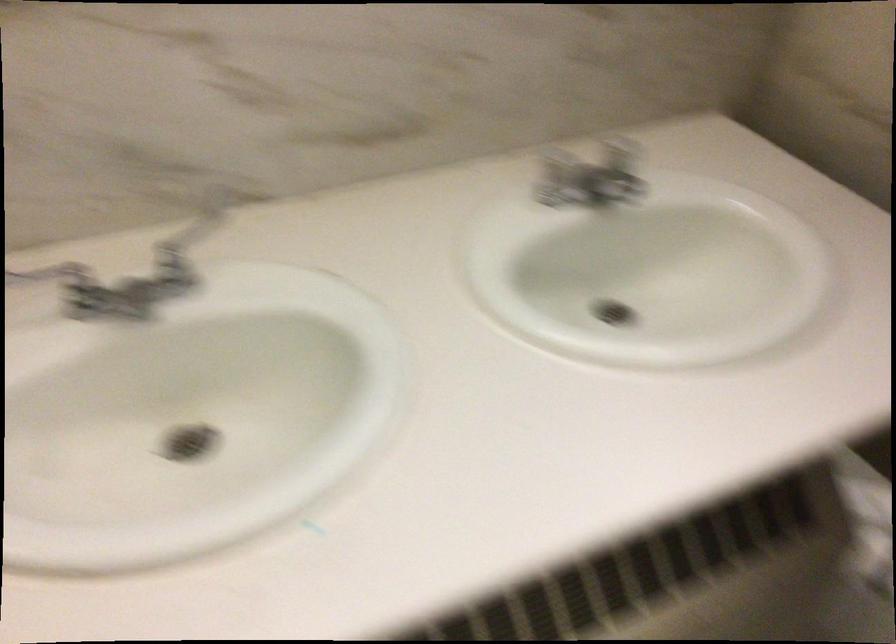
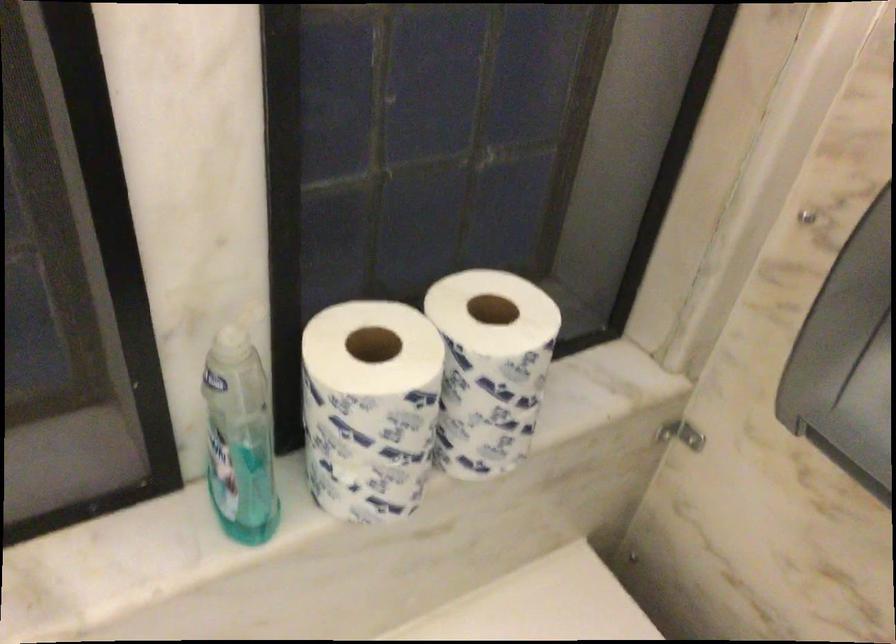
Question: The camera is either moving clockwise (left) or counter-clockwise (right) around the object. The first image is from the beginning of the video and the second image is from the end. Is the camera moving left or right when shooting the video?

Choices:
 (A) Left
 (B) Right

Answer: (A)